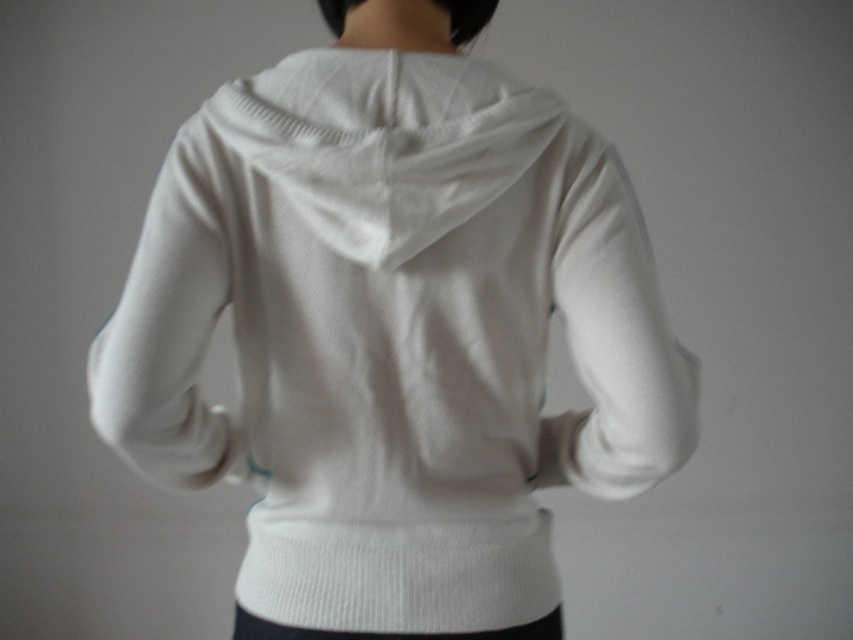
You are trying to determine if the white knitted sweater at center can fit through a small opening that is just wide enough for the white knitted neckband at center. Based on the scene, can the sweater pass through the opening?

The white knitted sweater at center might be wider than white knitted neckband at center, so it may not fit through the opening designed for the neckband.

You are trying to decide whether to wear the white knitted sweater at center and the white knitted neckband at center together. Based on their sizes, will the neckband fit comfortably under the sweater?

The white knitted sweater at center is bigger than the white knitted neckband at center, so the neckband will fit comfortably under the sweater.